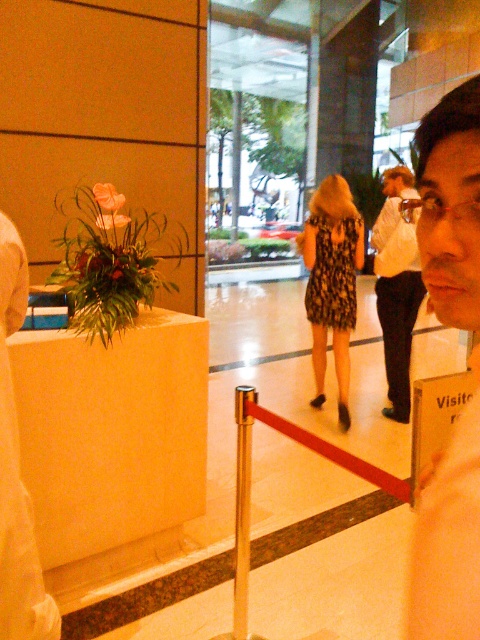
Question: Which point appears closest to the camera in this image?

Choices:
 (A) (346, 241)
 (B) (452, 515)
 (C) (326, 227)

Answer: (B)

Question: Does floral-patterned dress at center have a greater width compared to white shirt at center?

Choices:
 (A) no
 (B) yes

Answer: (B)

Question: Does matte black face at upper right lie in front of floral-patterned dress at center?

Choices:
 (A) yes
 (B) no

Answer: (A)

Question: Which object appears farthest from the camera in this image?

Choices:
 (A) matte black face at upper right
 (B) floral-patterned dress at center
 (C) floral-patterned fabric dress at center
 (D) white shirt at center

Answer: (C)

Question: Which of the following is the closest to the observer?

Choices:
 (A) (321, 275)
 (B) (382, 317)
 (C) (352, 308)

Answer: (C)

Question: Is matte black face at upper right to the right of floral-patterned dress at center from the viewer's perspective?

Choices:
 (A) yes
 (B) no

Answer: (B)